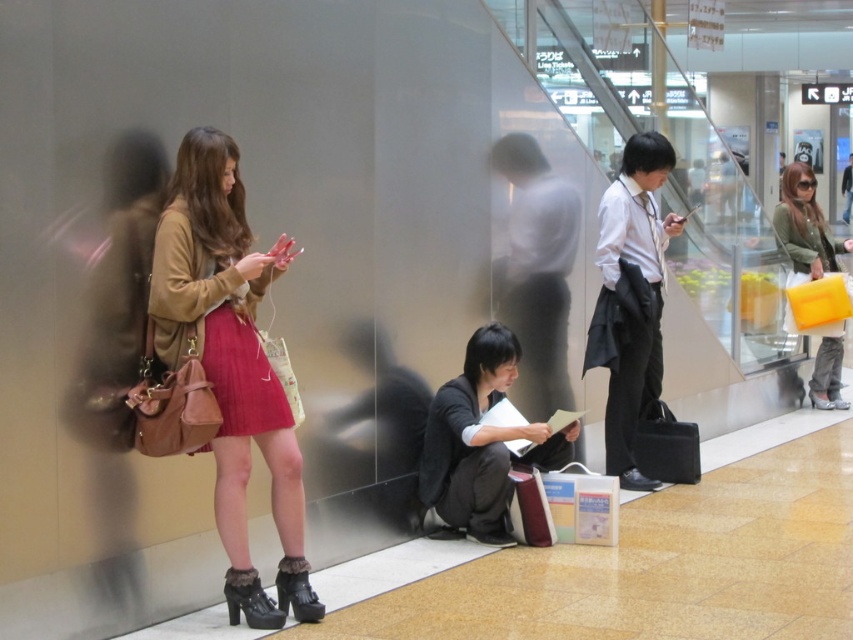
Is velvet pink skirt at left smaller than matte olive green jacket at right?

Yes, velvet pink skirt at left is smaller than matte olive green jacket at right.

Who is positioned more to the left, velvet pink skirt at left or matte olive green jacket at right?

From the viewer's perspective, velvet pink skirt at left appears more on the left side.

Who is more distant from viewer, (224, 426) or (833, 244)?

Positioned behind is point (833, 244).

This screenshot has height=640, width=853. In order to click on velvet pink skirt at left in this screenshot , I will do `click(213, 324)`.

From the picture: Who is more forward, (473, 426) or (785, 220)?

Point (473, 426) is more forward.

Looking at this image, does black matte jacket at lower center have a smaller size compared to matte olive green jacket at right?

Yes, black matte jacket at lower center is smaller than matte olive green jacket at right.

You are a GUI agent. You are given a task and a screenshot of the screen. Output one action in this format:
    pyautogui.click(x=<x>, y=<y>)
    Task: Click on the black matte jacket at lower center
    This screenshot has height=640, width=853.
    Given the screenshot: What is the action you would take?
    pyautogui.click(x=480, y=442)

Who is taller, matte brown purse at left or black matte jacket at lower center?

With more height is matte brown purse at left.

Is matte brown purse at left taller than black matte jacket at lower center?

Yes, matte brown purse at left is taller than black matte jacket at lower center.

This screenshot has width=853, height=640. In order to click on matte brown purse at left in this screenshot , I will do `click(231, 364)`.